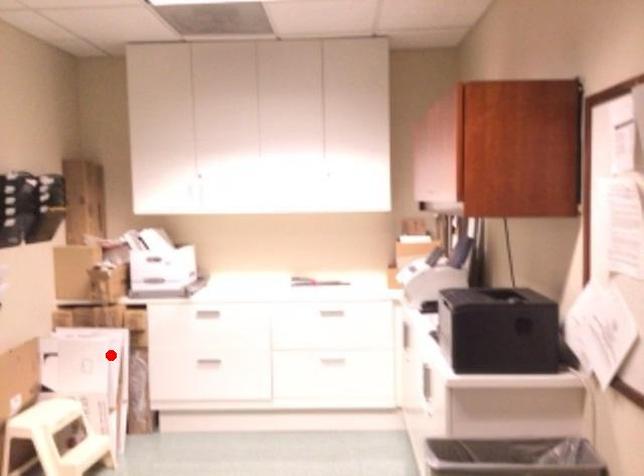
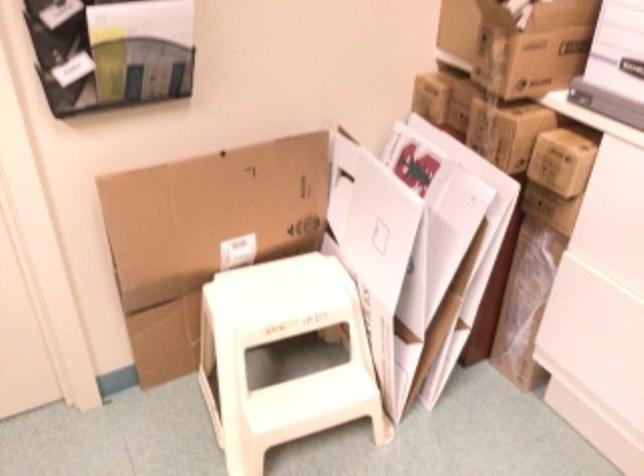
Where in the second image is the point corresponding to the highlighted location from the first image?

(453, 228)